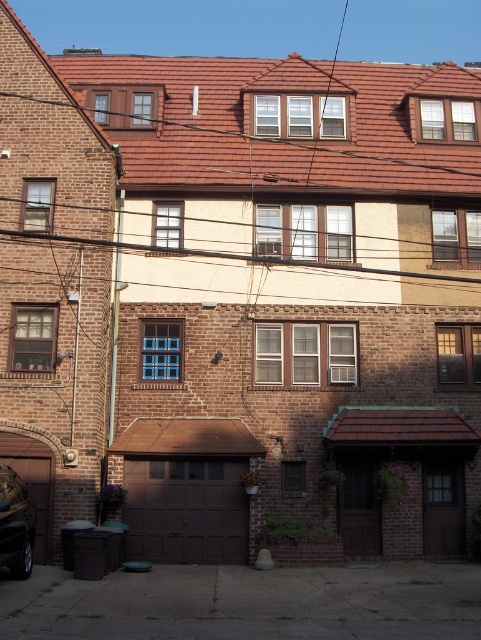
You are a delivery person trying to determine which garage door to use for a large delivery truck. The truck requires a garage door that is at least 2.5 meters wide. Based on the scene, which garage door between the brown wood garage door at lower center and the brown matte garage door at lower center should you choose?

The brown wood garage door at lower center has a larger size compared to the brown matte garage door at lower center, so you should choose the brown wood garage door at lower center since it is larger and likely meets the truck width requirement.

You are a delivery person with a 1.2 meter wide cart. You need to navigate between the brown wood garage door at lower center and the brown wood garage door at lower left. Can your cart fit through the space between them?

The distance between the brown wood garage door at lower center and the brown wood garage door at lower left is 9.49 meters. Since your cart is only 1.2 meters wide, it can easily fit through the space between them as the width is sufficient.